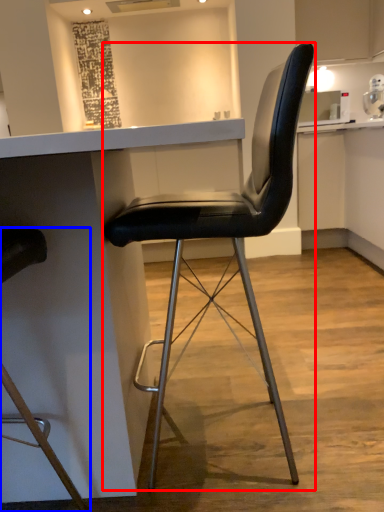
Question: Among these objects, which one is farthest to the camera, chair (highlighted by a red box) or chair (highlighted by a blue box)?

Choices:
 (A) chair
 (B) chair

Answer: (A)